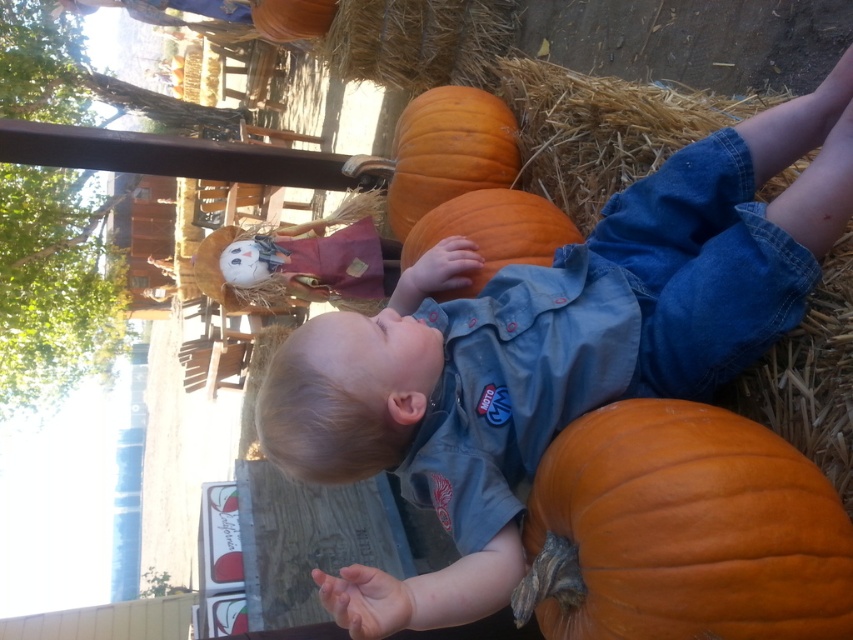
You are a photographer trying to capture the child in the scene. To ensure the smooth denim shirt at center is visible above the orange matte pumpkin at center in the photo, where should you position the camera relative to the current viewpoint?

The smooth denim shirt at center is located below the orange matte pumpkin at center. To make the smooth denim shirt at center visible above the orange matte pumpkin at center in the photo, you should position the camera lower than the current viewpoint so that the shirt appears higher in the frame relative to the pumpkin.